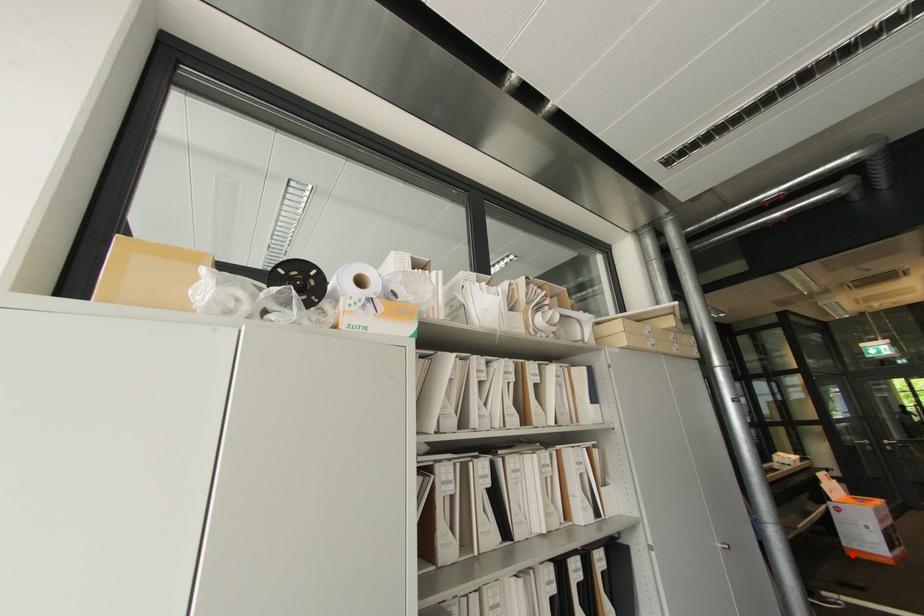
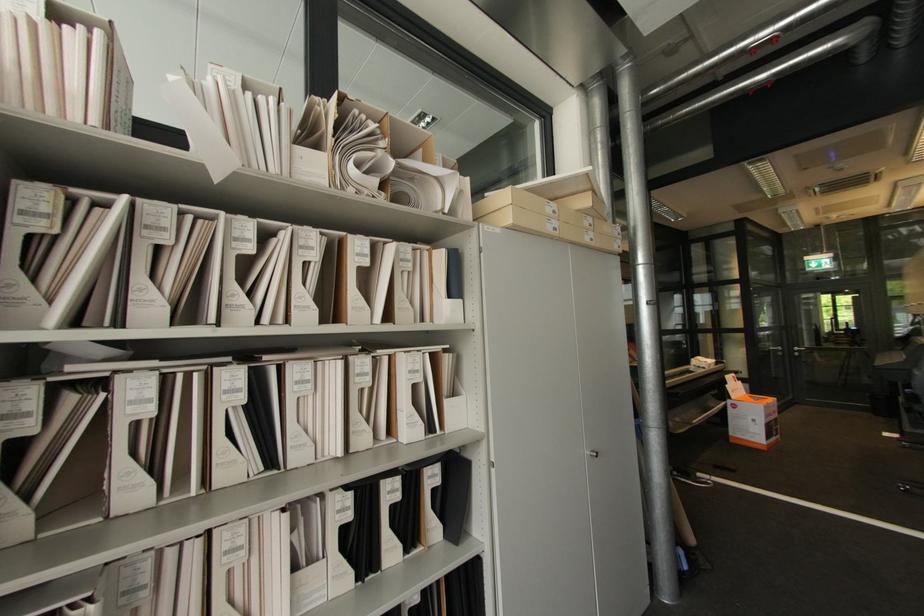
Question: I am providing you with two images of the same scene from different viewpoints. Given a red point in image1, look at the same physical point in image2. Is it:

Choices:
 (A) Closer to the viewpoint
 (B) Farther from the viewpoint

Answer: (B)